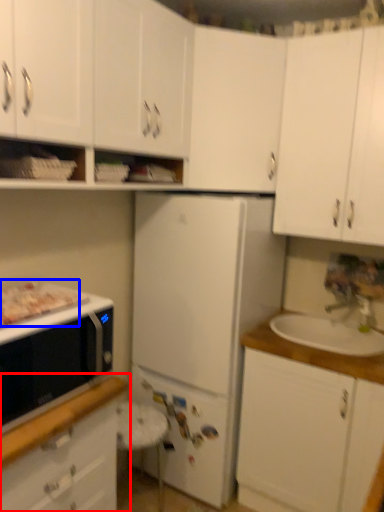
Question: Which object is closer to the camera taking this photo, cabinetry (highlighted by a red box) or food (highlighted by a blue box)?

Choices:
 (A) cabinetry
 (B) food

Answer: (A)